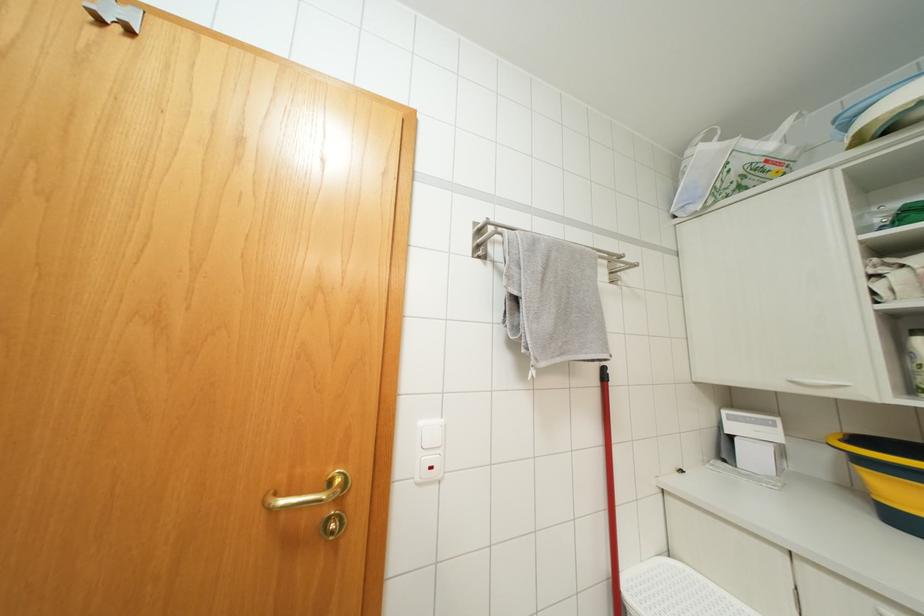
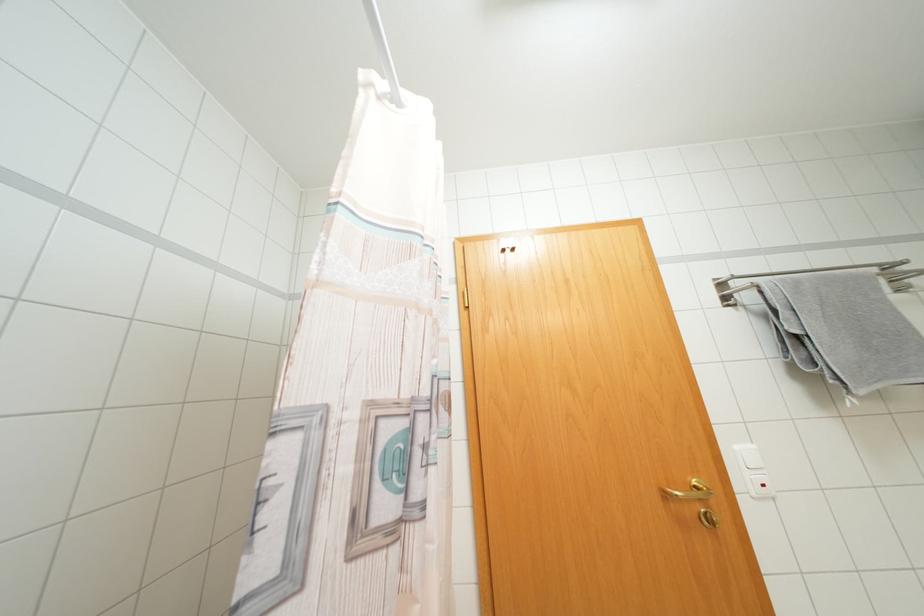
Question: The camera is either moving clockwise (left) or counter-clockwise (right) around the object. The first image is from the beginning of the video and the second image is from the end. Is the camera moving left or right when shooting the video?

Choices:
 (A) Left
 (B) Right

Answer: (B)